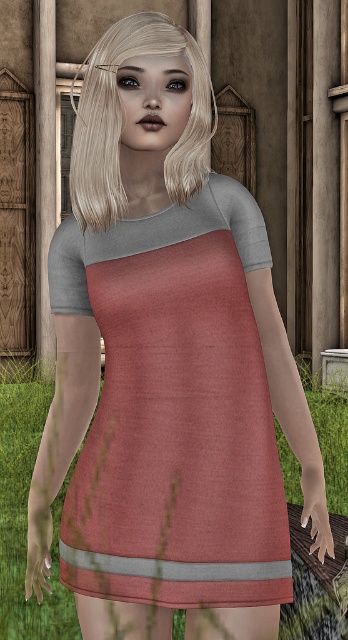
You are a photographer setting up a shoot in this rustic outdoor scene. You need to place a small prop on the ground near the matte pink fabric dress at center. Where should you position it to ensure it rests on the green grass at lower center?

The matte pink fabric dress at center is located above the green grass at lower center, so placing the prop directly beneath the dress will ensure it rests on the green grass at lower center.

You are a drone operator trying to capture a photo of the character in the scene. The green grass at lower center is where you want to focus. Given that the coordinates of the focus point are point [26,509], will adjusting the focus to this point ensure the character is in focus?

The green grass at lower center is represented by point [26,509]. Since the character is standing outdoors in a rustic setting with the grassy terrain behind them, adjusting the focus to this point may not ensure the character is in focus as the character is likely in front of the grass.

Consider the image. You are standing in a field and want to reach the point marked as point [109,333]. If your walking path is straight and you can walk at a speed of 1.5 meters per second, how many seconds will it take you to reach the point?

The distance between you and point [109,333] is 1.95 meters. At a walking speed of 1.5 meters per second, it will take approximately 1.3 seconds to reach the point.